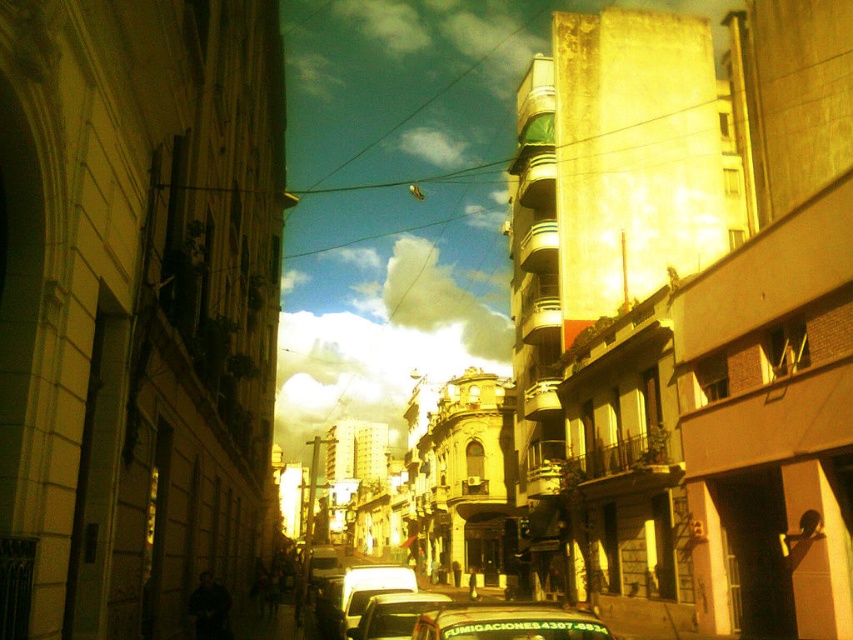
In the scene shown: Does metallic green taxi at center come behind metallic silver car at center?

No, it is not.

Does metallic green taxi at center have a greater height compared to metallic silver car at center?

No, metallic green taxi at center is not taller than metallic silver car at center.

Identify the location of metallic green taxi at center. (508, 624).

Can you confirm if metallic green taxi at center is smaller than shiny silver car at center?

Indeed, metallic green taxi at center has a smaller size compared to shiny silver car at center.

Who is more forward, (502, 632) or (412, 579)?

Point (502, 632) is more forward.

Where is `metallic green taxi at center`? This screenshot has width=853, height=640. metallic green taxi at center is located at coordinates (508, 624).

Which of these two, shiny silver car at center or metallic silver car at center, stands shorter?

Standing shorter between the two is metallic silver car at center.

This screenshot has width=853, height=640. What do you see at coordinates (357, 595) in the screenshot? I see `shiny silver car at center` at bounding box center [357, 595].

Is point (335, 609) positioned after point (433, 602)?

Yes, point (335, 609) is farther from viewer.

This screenshot has width=853, height=640. In order to click on shiny silver car at center in this screenshot , I will do `click(357, 595)`.